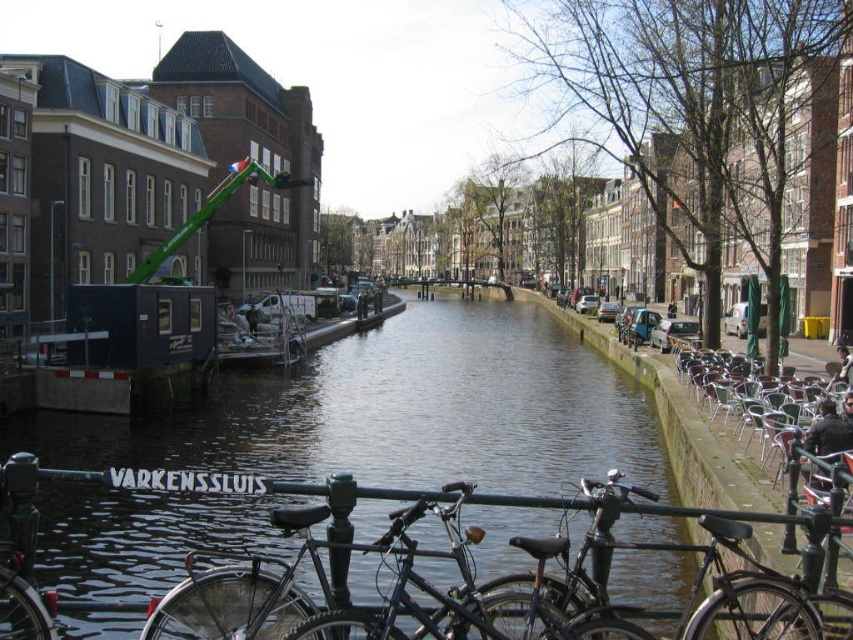
Question: Among these objects, which one is nearest to the camera?

Choices:
 (A) shiny black bicycle at center
 (B) smooth concrete water at center

Answer: (A)

Question: Where is smooth concrete water at center located in relation to shiny black bicycle at center in the image?

Choices:
 (A) left
 (B) right

Answer: (A)

Question: Which of the following is the farthest from the observer?

Choices:
 (A) smooth concrete water at center
 (B) shiny black bicycle at center

Answer: (A)

Question: Can you confirm if smooth concrete water at center is positioned to the left of shiny black bicycle at center?

Choices:
 (A) no
 (B) yes

Answer: (B)

Question: Can you confirm if smooth concrete water at center is positioned below shiny black bicycle at center?

Choices:
 (A) yes
 (B) no

Answer: (B)